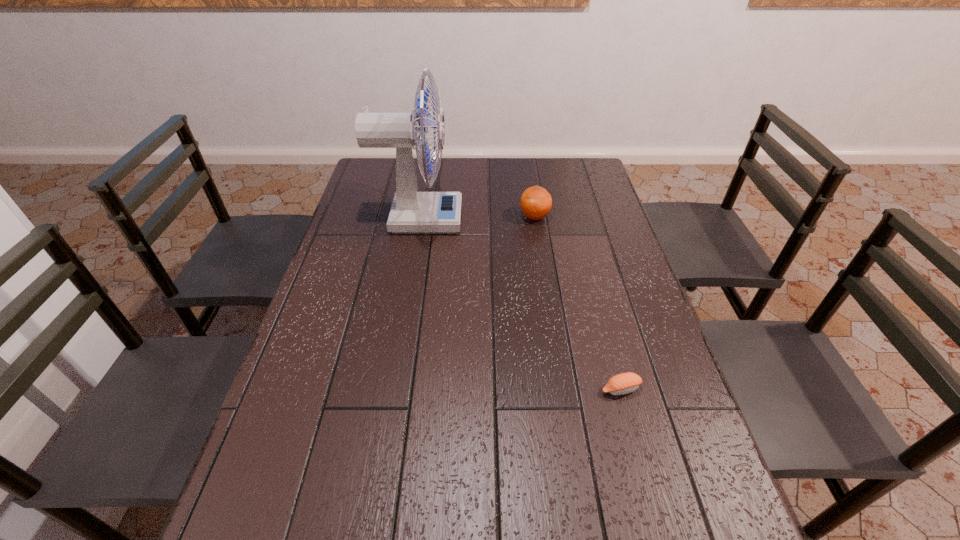
The image size is (960, 540). Identify the location of empty space between the second object from right to left and the leftmost object. (477, 218).

In order to click on free space that is in between the rightmost object and the tallest object in this screenshot , I will do `click(519, 304)`.

This screenshot has height=540, width=960. What are the coordinates of `free space between the rightmost object and the second object from left to right` in the screenshot? It's located at (578, 303).

Identify the location of blank region between the rightmost object and the second object from left to right. [578, 303].

At what (x,y) coordinates should I click in order to perform the action: click on free space between the shortest object and the second object from left to right. Please return your answer as a coordinate pair (x, y). This screenshot has height=540, width=960. Looking at the image, I should click on (578, 303).

The image size is (960, 540). What are the coordinates of `object that is the closest one to the second object from right to left` in the screenshot? It's located at (411, 211).

Locate an element on the screen. The image size is (960, 540). object that is the second nearest to the fan is located at coordinates (624, 383).

Image resolution: width=960 pixels, height=540 pixels. I want to click on blank area in the image that satisfies the following two spatial constraints: 1. on the front side of the second shortest object; 2. on the front-facing side of the leftmost object, so click(535, 219).

Identify the location of free space that satisfies the following two spatial constraints: 1. on the front-facing side of the shortest object; 2. on the right side of the leftmost object. (390, 389).

Where is `free spot that satisfies the following two spatial constraints: 1. on the front-facing side of the leftmost object; 2. on the left side of the sushi`? This screenshot has height=540, width=960. free spot that satisfies the following two spatial constraints: 1. on the front-facing side of the leftmost object; 2. on the left side of the sushi is located at coordinates (390, 389).